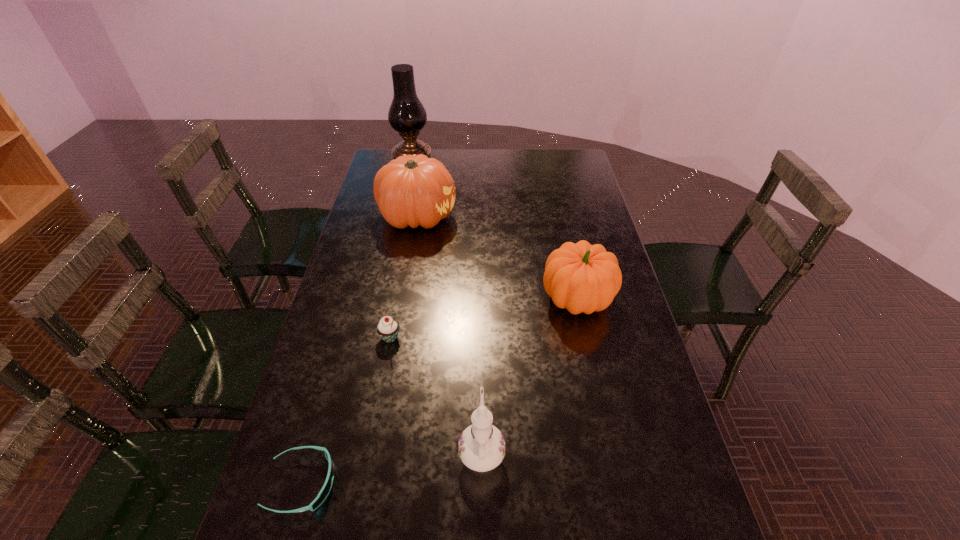
You are a GUI agent. You are given a task and a screenshot of the screen. Output one action in this format:
    pyautogui.click(x=<x>, y=<y>)
    Task: Click on the free space located 0.060m on the front of the oil lamp
    Image resolution: width=960 pixels, height=540 pixels.
    Given the screenshot: What is the action you would take?
    pyautogui.click(x=409, y=183)

Locate an element on the screen. Image resolution: width=960 pixels, height=540 pixels. vacant space located on the carved face of the farther pumpkin is located at coordinates (545, 216).

The width and height of the screenshot is (960, 540). I want to click on vacant space located 0.350m at the spout of the fifth object from left to right, so (481, 313).

The height and width of the screenshot is (540, 960). In order to click on vacant space located 0.280m at the spout of the fifth object from left to right in this screenshot , I will do `click(481, 332)`.

In order to click on vacant space located 0.260m at the spout of the fifth object from left to right in this screenshot , I will do `click(481, 337)`.

Where is `vacant space located on the left of the nearer pumpkin`? Image resolution: width=960 pixels, height=540 pixels. vacant space located on the left of the nearer pumpkin is located at coordinates (421, 299).

The height and width of the screenshot is (540, 960). I want to click on vacant space situated 0.060m on the left of the cupcake, so [x=357, y=338].

Where is `blank area located 0.360m on the front-facing side of the sunglasses`? The image size is (960, 540). blank area located 0.360m on the front-facing side of the sunglasses is located at coordinates (503, 483).

I want to click on object located at the far edge, so click(x=407, y=115).

Locate an element on the screen. oil lamp located in the left edge section of the desktop is located at coordinates (407, 115).